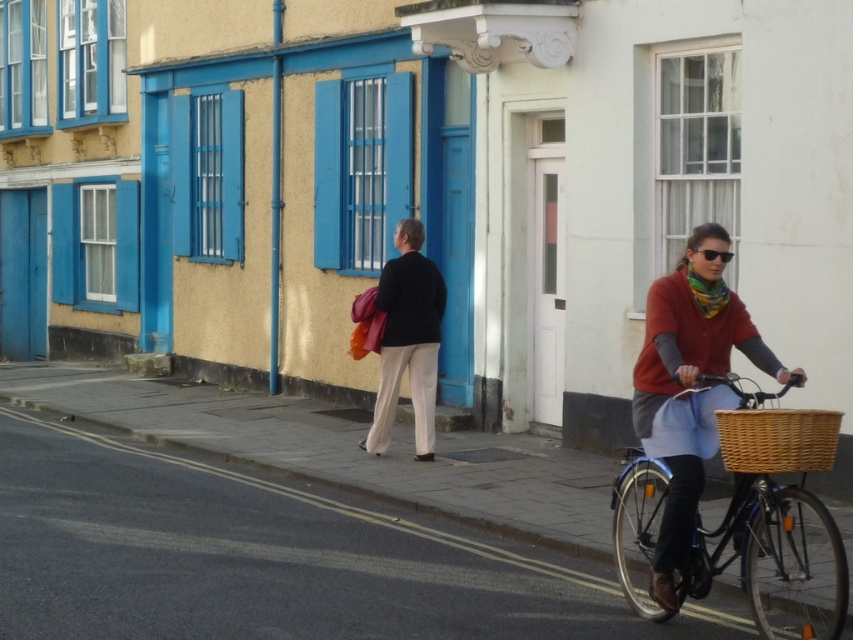
Question: Which of the following is the closest to the observer?

Choices:
 (A) matte red sweater at center
 (B) multicolored knitted scarf at center
 (C) black plastic sunglasses at center

Answer: (A)

Question: Which of the following is the farthest from the observer?

Choices:
 (A) blue metallic bicycle at right
 (B) woven brown basket at right
 (C) matte red sweater at center
 (D) black matte jacket at center

Answer: (D)

Question: In this image, where is blue metallic bicycle at right located relative to black matte jacket at center?

Choices:
 (A) above
 (B) below

Answer: (B)

Question: Can you confirm if woven brown basket at right is smaller than multicolored knitted scarf at center?

Choices:
 (A) yes
 (B) no

Answer: (B)

Question: Is blue metallic bicycle at right thinner than multicolored knitted scarf at center?

Choices:
 (A) yes
 (B) no

Answer: (B)

Question: Among these objects, which one is nearest to the camera?

Choices:
 (A) matte red sweater at center
 (B) multicolored knitted scarf at center
 (C) woven brown basket at right
 (D) black matte jacket at center

Answer: (C)